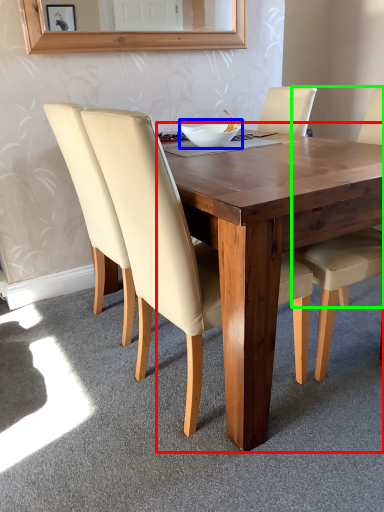
Question: Which object is positioned farthest from round table (highlighted by a red box)? Select from bowl (highlighted by a blue box) and chair (highlighted by a green box).

Choices:
 (A) bowl
 (B) chair

Answer: (A)